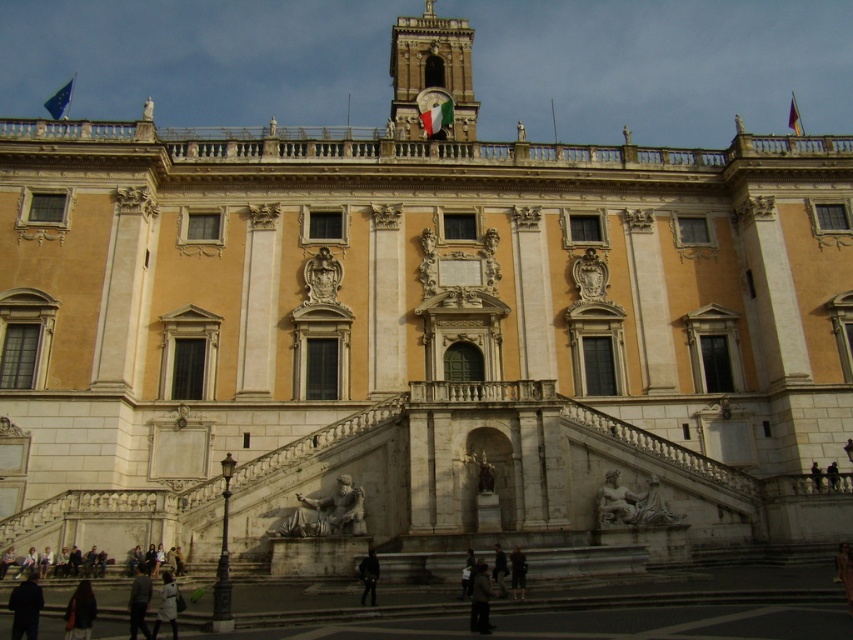
Question: Does marble statue at lower center lie in front of matte stone statue at lower right?

Choices:
 (A) yes
 (B) no

Answer: (A)

Question: Among these objects, which one is farthest from the camera?

Choices:
 (A) matte stone statue at lower right
 (B) dark brown leather jacket at center
 (C) dark gray jacket at lower left
 (D) dark gray fabric jacket at lower left

Answer: (A)

Question: Can you confirm if matte stone statue at lower right is bigger than dark brown leather jacket at lower center?

Choices:
 (A) no
 (B) yes

Answer: (B)

Question: From the image, what is the correct spatial relationship of dark brown leather jacket at lower left in relation to matte stone statue at lower right?

Choices:
 (A) left
 (B) right

Answer: (A)

Question: Which point is farther from the camera taking this photo?

Choices:
 (A) (483, 570)
 (B) (134, 588)
 (C) (79, 600)

Answer: (A)

Question: Which point is farther to the camera?

Choices:
 (A) (811, 461)
 (B) (20, 632)
 (C) (146, 608)
 (D) (175, 589)

Answer: (A)